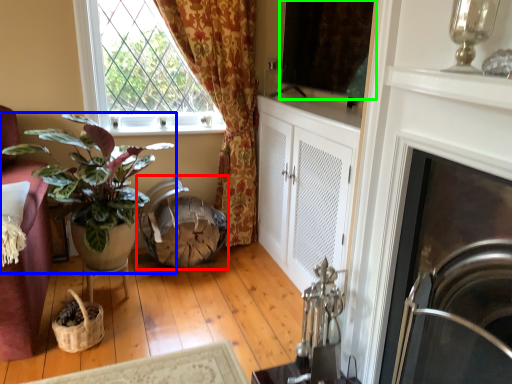
Question: Which object is positioned farthest from swivel chair (highlighted by a red box)? Select from houseplant (highlighted by a blue box) and window screen (highlighted by a green box).

Choices:
 (A) houseplant
 (B) window screen

Answer: (B)